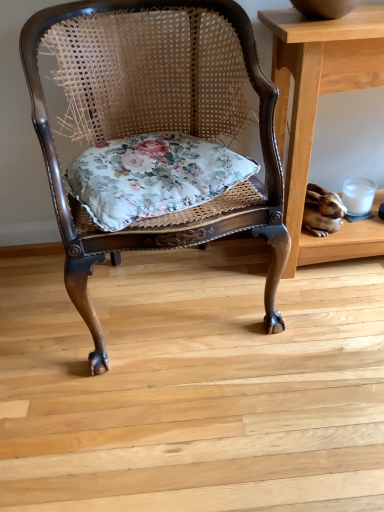
Question: Is floral fabric cushion at center shorter than rattan chair with floral cushion at center?

Choices:
 (A) yes
 (B) no

Answer: (A)

Question: Considering the relative positions of floral fabric cushion at center and rattan chair with floral cushion at center in the image provided, is floral fabric cushion at center to the left of rattan chair with floral cushion at center from the viewer's perspective?

Choices:
 (A) yes
 (B) no

Answer: (B)

Question: Is floral fabric cushion at center far away from rattan chair with floral cushion at center?

Choices:
 (A) no
 (B) yes

Answer: (A)

Question: Considering the relative sizes of floral fabric cushion at center and rattan chair with floral cushion at center in the image provided, is floral fabric cushion at center smaller than rattan chair with floral cushion at center?

Choices:
 (A) yes
 (B) no

Answer: (A)

Question: From a real-world perspective, is floral fabric cushion at center physically above rattan chair with floral cushion at center?

Choices:
 (A) yes
 (B) no

Answer: (A)

Question: Is floral fabric cushion at center behind rattan chair with floral cushion at center?

Choices:
 (A) yes
 (B) no

Answer: (A)

Question: From the image's perspective, is rattan chair with floral cushion at center beneath light brown wooden table at right?

Choices:
 (A) no
 (B) yes

Answer: (B)

Question: Does rattan chair with floral cushion at center have a larger size compared to light brown wooden table at right?

Choices:
 (A) yes
 (B) no

Answer: (A)

Question: From a real-world perspective, is rattan chair with floral cushion at center located higher than light brown wooden table at right?

Choices:
 (A) no
 (B) yes

Answer: (B)

Question: Considering the relative positions of rattan chair with floral cushion at center and light brown wooden table at right in the image provided, is rattan chair with floral cushion at center to the left of light brown wooden table at right from the viewer's perspective?

Choices:
 (A) no
 (B) yes

Answer: (B)

Question: Is rattan chair with floral cushion at center shorter than light brown wooden table at right?

Choices:
 (A) no
 (B) yes

Answer: (A)

Question: Is rattan chair with floral cushion at center aimed at light brown wooden table at right?

Choices:
 (A) yes
 (B) no

Answer: (B)

Question: Does light brown wooden table at right have a lesser height compared to rattan chair with floral cushion at center?

Choices:
 (A) no
 (B) yes

Answer: (B)